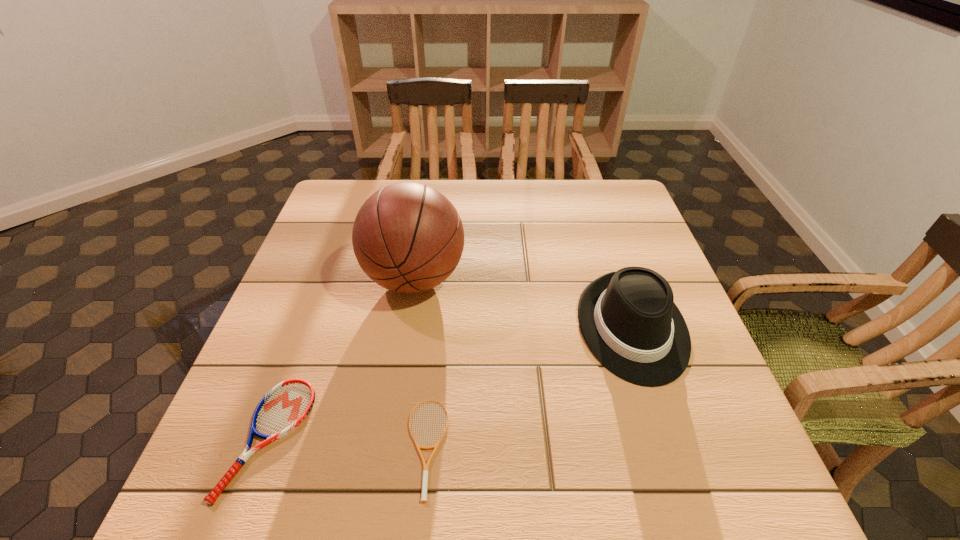
Locate an element on the screen. the tallest object is located at coordinates (407, 237).

At what (x,y) coordinates should I click in order to perform the action: click on the rightmost object. Please return your answer as a coordinate pair (x, y). This screenshot has width=960, height=540. Looking at the image, I should click on (628, 319).

At what (x,y) coordinates should I click in order to perform the action: click on fedora. Please return your answer as a coordinate pair (x, y). The image size is (960, 540). Looking at the image, I should click on (628, 319).

Where is `the left tennis racket`? This screenshot has width=960, height=540. the left tennis racket is located at coordinates (285, 406).

The height and width of the screenshot is (540, 960). Find the location of `the taller tennis racket`. the taller tennis racket is located at coordinates (285, 406).

Identify the location of the right tennis racket. (425, 466).

Identify the location of the shortest object. The height and width of the screenshot is (540, 960). (425, 466).

This screenshot has height=540, width=960. I want to click on free space located on the right of the basketball, so click(x=590, y=279).

In order to click on free space located on the front-facing side of the third shortest object in this screenshot , I will do `click(664, 425)`.

The image size is (960, 540). I want to click on vacant space located 0.060m on the right of the left tennis racket, so click(338, 437).